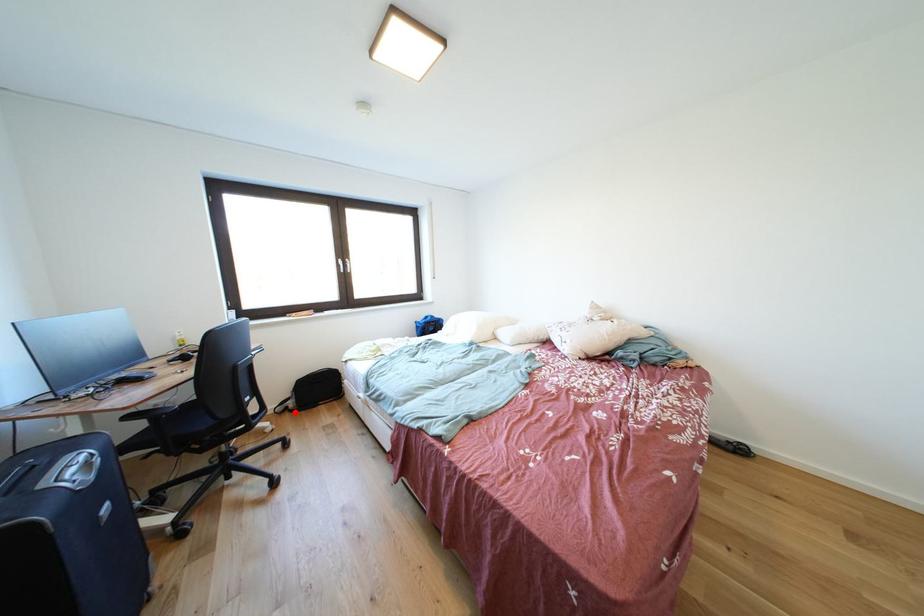
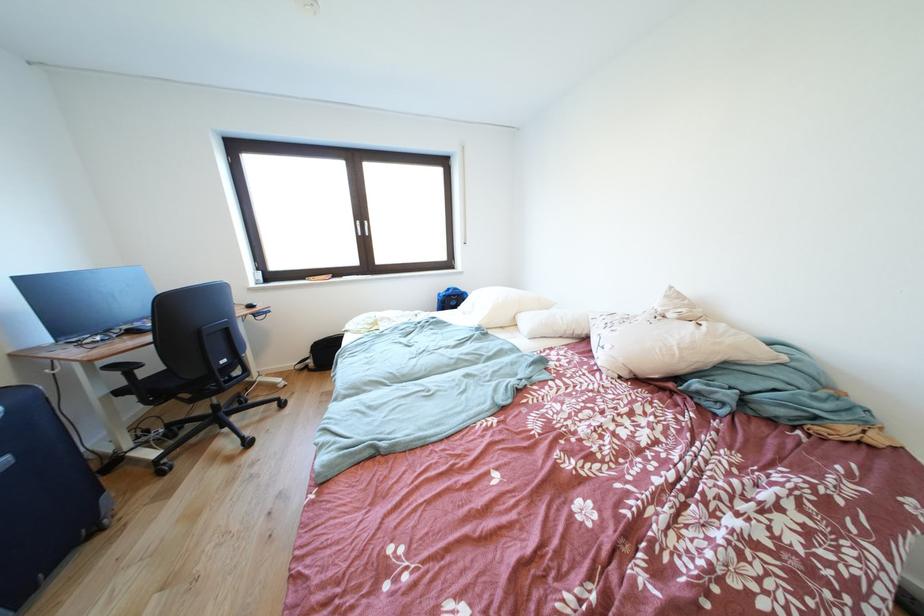
The point at the highlighted location is marked in the first image. Where is the corresponding point in the second image?

(315, 371)